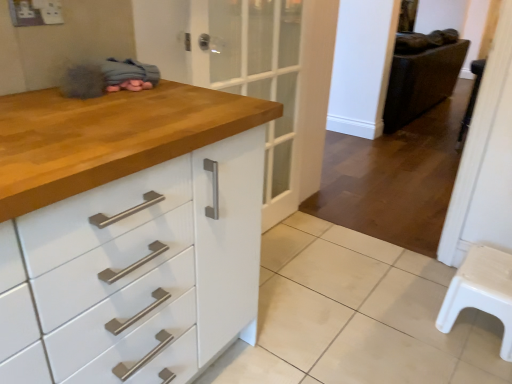
Where is `leather-like dark brown chair at right`? This screenshot has height=384, width=512. leather-like dark brown chair at right is located at coordinates (422, 74).

Measure the distance between white plastic stool at lower right and camera.

They are 1.48 meters apart.

At what (x,y) coordinates should I click in order to perform the action: click on leather-like dark brown chair at right. Please return your answer as a coordinate pair (x, y). This screenshot has width=512, height=384. Looking at the image, I should click on (422, 74).

Choose the correct answer: Is white glossy tile at lower center inside white plastic stool at lower right or outside it?

white glossy tile at lower center is outside white plastic stool at lower right.

Is white glossy tile at lower center touching white plastic stool at lower right?

white glossy tile at lower center and white plastic stool at lower right are clearly separated.

How far apart are white glossy tile at lower center and white plastic stool at lower right?

white glossy tile at lower center and white plastic stool at lower right are 11.92 inches apart from each other.

Is white glossy tile at lower center oriented away from white plastic stool at lower right?

No, white glossy tile at lower center is not facing away from white plastic stool at lower right.

Which is more distant, (467,293) or (316,381)?

Positioned behind is point (467,293).

This screenshot has width=512, height=384. In order to click on tile below the white plastic stool at lower right (from the image's perspective) in this screenshot , I will do `click(356, 316)`.

From a real-world perspective, is white plastic stool at lower right physically located above or below white glossy tile at lower center?

white plastic stool at lower right is situated higher than white glossy tile at lower center in the real world.

Would you say white glossy tile at lower center is part of white plastic stool at lower right's contents?

That's incorrect, white glossy tile at lower center is not inside white plastic stool at lower right.

From the image's perspective, does leather-like dark brown chair at right appear higher than white glossy tile at lower center?

Yes, from the image's perspective, leather-like dark brown chair at right is above white glossy tile at lower center.

Considering the relative sizes of leather-like dark brown chair at right and white glossy tile at lower center in the image provided, is leather-like dark brown chair at right taller than white glossy tile at lower center?

Correct, leather-like dark brown chair at right is much taller as white glossy tile at lower center.

Which is correct: leather-like dark brown chair at right is inside white glossy tile at lower center, or outside of it?

leather-like dark brown chair at right is spatially situated outside white glossy tile at lower center.

Find the location of `tile on the left of the leather-like dark brown chair at right`. tile on the left of the leather-like dark brown chair at right is located at coordinates (356, 316).

Is point (461, 144) positioned in front of point (356, 284)?

No.

Would you say white plastic step stool at right is a long distance from white glossy tile at lower center?

Yes, white plastic step stool at right and white glossy tile at lower center are quite far apart.

Could you tell me if white plastic step stool at right is facing white glossy tile at lower center?

No, white plastic step stool at right is not turned towards white glossy tile at lower center.

From a real-world perspective, is white plastic step stool at right physically above white glossy tile at lower center?

Indeed, from a real-world perspective, white plastic step stool at right stands above white glossy tile at lower center.

Which object is positioned more to the left, white plastic stool at lower right or leather-like dark brown chair at right?

white plastic stool at lower right is more to the left.

Consider the image. Which is less distant, (x=500, y=302) or (x=448, y=42)?

Point (x=500, y=302)

Where is `chair above the white plastic step stool at right (from the image's perspective)`? chair above the white plastic step stool at right (from the image's perspective) is located at coordinates (422, 74).

Does white plastic step stool at right have a greater width compared to leather-like dark brown chair at right?

Incorrect, the width of white plastic step stool at right does not surpass that of leather-like dark brown chair at right.

Between white plastic step stool at right and leather-like dark brown chair at right, which one has smaller size?

white plastic step stool at right.

Is the depth of white plastic step stool at right less than that of leather-like dark brown chair at right?

Yes, it is.

Which is more distant, [323,355] or [474,83]?

The point [474,83] is more distant.

From the picture: Is white plastic step stool at right located within white glossy tile at lower center?

No, white plastic step stool at right is not a part of white glossy tile at lower center.

From the image's perspective, which is above, white glossy tile at lower center or white plastic step stool at right?

white plastic step stool at right is shown above in the image.

Can you confirm if white glossy tile at lower center is taller than white plastic step stool at right?

Incorrect, the height of white glossy tile at lower center is not larger of that of white plastic step stool at right.

Where is `tile below the white plastic stool at lower right (from the image's perspective)`? tile below the white plastic stool at lower right (from the image's perspective) is located at coordinates (356, 316).

I want to click on tile on the left of the white plastic stool at lower right, so click(x=356, y=316).

From the image, which object appears to be farther from leather-like dark brown chair at right, white glossy tile at lower center or white plastic stool at lower right?

white plastic stool at lower right.

When comparing their distances from white plastic step stool at right, does leather-like dark brown chair at right or white plastic stool at lower right seem closer?

white plastic stool at lower right.

Which object lies further to the anchor point white plastic step stool at right, white glossy tile at lower center or white plastic stool at lower right?

Based on the image, white glossy tile at lower center appears to be further to white plastic step stool at right.

Based on the photo, considering their positions, is white plastic stool at lower right positioned closer to white glossy tile at lower center than leather-like dark brown chair at right?

Among the two, white plastic stool at lower right is located nearer to white glossy tile at lower center.

Estimate the real-world distances between objects in this image. Which object is further from white plastic step stool at right, white glossy tile at lower center or leather-like dark brown chair at right?

leather-like dark brown chair at right is further to white plastic step stool at right.

From the image, which object appears to be nearer to white plastic stool at lower right, leather-like dark brown chair at right or white glossy tile at lower center?

white glossy tile at lower center lies closer to white plastic stool at lower right than the other object.

When comparing their distances from white plastic stool at lower right, does leather-like dark brown chair at right or white plastic step stool at right seem closer?

Among the two, white plastic step stool at right is located nearer to white plastic stool at lower right.

Based on their spatial positions, is leather-like dark brown chair at right or white plastic stool at lower right closer to white glossy tile at lower center?

Among the two, white plastic stool at lower right is located nearer to white glossy tile at lower center.

You are a GUI agent. You are given a task and a screenshot of the screen. Output one action in this format:
    pyautogui.click(x=<x>, y=<y>)
    Task: Click on the furniture between white glossy tile at lower center and leather-like dark brown chair at right in the front-back direction
    The image size is (512, 384).
    Given the screenshot: What is the action you would take?
    pyautogui.click(x=481, y=291)

Image resolution: width=512 pixels, height=384 pixels. I want to click on step stool positioned between white plastic stool at lower right and leather-like dark brown chair at right from near to far, so click(471, 99).

At what (x,y) coordinates should I click in order to perform the action: click on step stool between white glossy tile at lower center and leather-like dark brown chair at right in the front-back direction. Please return your answer as a coordinate pair (x, y). Looking at the image, I should click on (471, 99).

I want to click on furniture located between white glossy tile at lower center and white plastic step stool at right in the depth direction, so click(x=481, y=291).